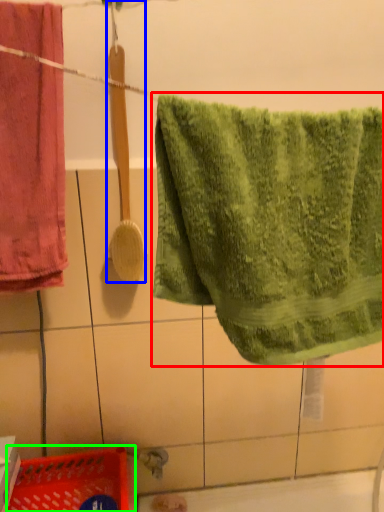
Question: Based on their relative distances, which object is farther from towel (highlighted by a red box)? Choose from brush (highlighted by a blue box) and basket (highlighted by a green box).

Choices:
 (A) brush
 (B) basket

Answer: (B)